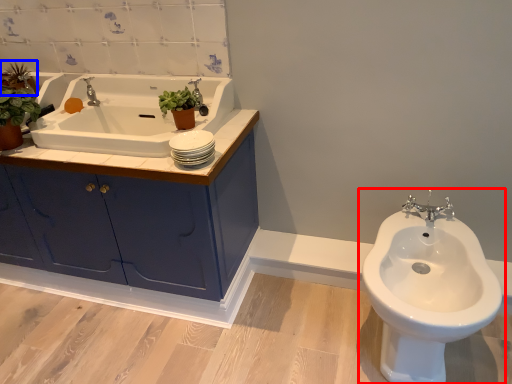
Question: Which object is further to the camera taking this photo, toilet (highlighted by a red box) or plant (highlighted by a blue box)?

Choices:
 (A) toilet
 (B) plant

Answer: (B)